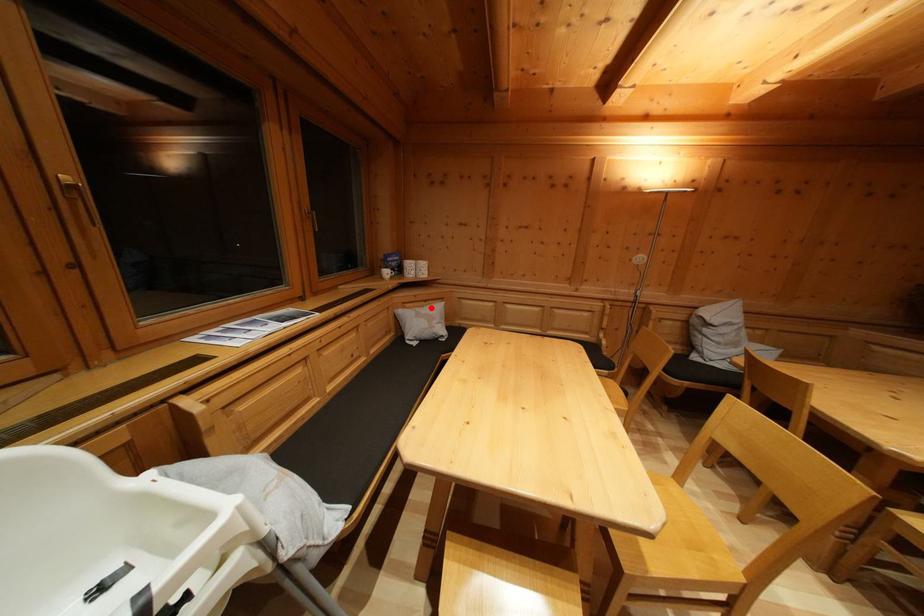
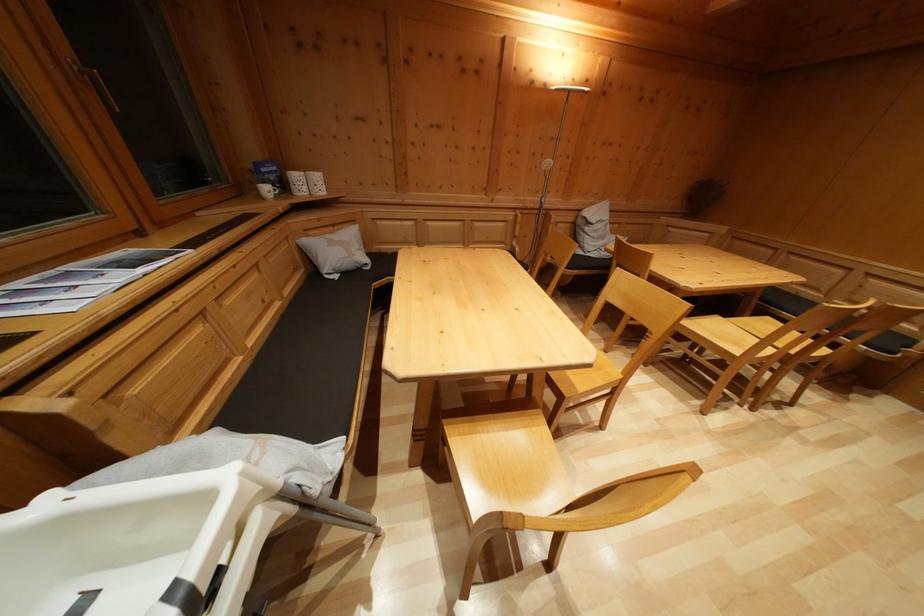
Question: A red point is marked in image1. In image2, is the corresponding 3D point closer to the camera or farther? Reply with the corresponding letter.

Choices:
 (A) The corresponding 3D point is closer.
 (B) The corresponding 3D point is farther.

Answer: (A)